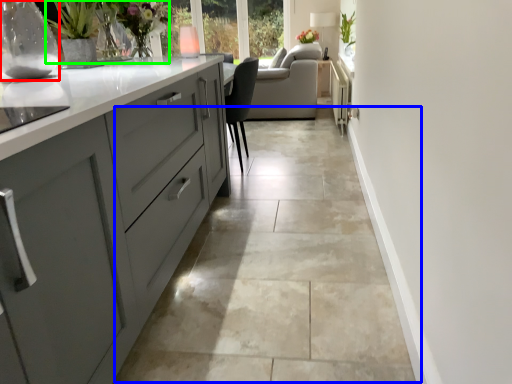
Question: Based on their relative distances, which object is farther from glass vase (highlighted by a red box)? Choose from concrete (highlighted by a blue box) and floral arrangement (highlighted by a green box).

Choices:
 (A) concrete
 (B) floral arrangement

Answer: (A)